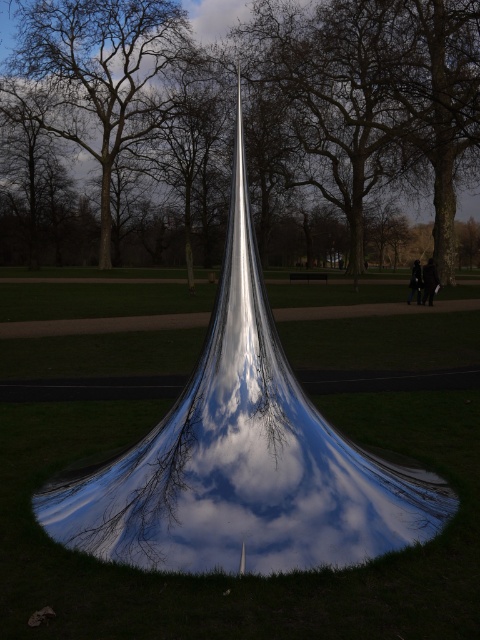
You are a park visitor standing at the base of the smooth bark tree at center and the brown bark tree at center. Which tree do you see the reflection of in the sculpture?

The smooth bark tree at center is positioned under the brown bark tree at center, so the reflection in the sculpture would show the brown bark tree at center since it is above the smooth one.

You are a photographer wanting to capture the shiny metallic sculpture at center and the smooth bark tree at center in a single shot. Since you want the sculpture to be the main focus, which object should you position closer to the camera?

The smooth bark tree at center is in front of the shiny metallic sculpture at center, so to make the sculpture the main focus, you should position the smooth bark tree at center closer to the camera.

You are a park visitor who wants to take a photo of both the smooth bark tree at center and the brown bark tree at center. Which tree should you stand closer to in order to capture both in a single frame?

You should stand closer to the brown bark tree at center because it is smaller in size compared to the smooth bark tree at center, allowing both to fit within the camera frame more easily.